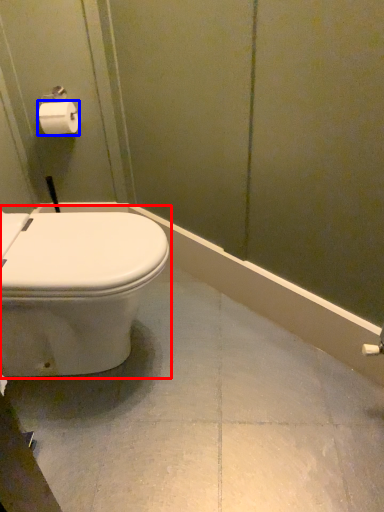
Question: Which point is further to the camera, toilet (highlighted by a red box) or toilet paper (highlighted by a blue box)?

Choices:
 (A) toilet
 (B) toilet paper

Answer: (B)